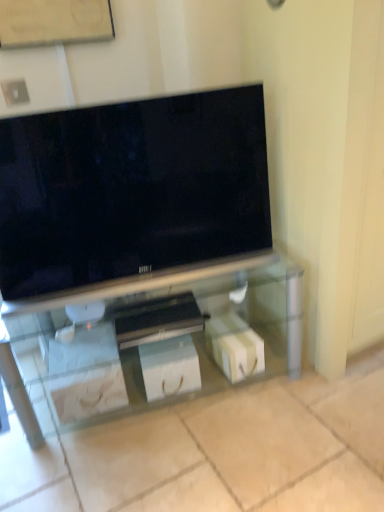
Question: In which direction should I rotate to look at white paper bag at lower center, the first box in the left-to-right sequence?

Choices:
 (A) left
 (B) right

Answer: (A)

Question: Can you confirm if wooden bulletin board at upper center is wider than white paper bag at lower center, the first box in the left-to-right sequence?

Choices:
 (A) yes
 (B) no

Answer: (B)

Question: From the image's perspective, does wooden bulletin board at upper center appear higher than white paper bag at lower center, the first box in the left-to-right sequence?

Choices:
 (A) no
 (B) yes

Answer: (B)

Question: Considering the relative positions of wooden bulletin board at upper center and white paper bag at lower center, the first box in the left-to-right sequence, in the image provided, is wooden bulletin board at upper center to the left of white paper bag at lower center, the first box in the left-to-right sequence, from the viewer's perspective?

Choices:
 (A) no
 (B) yes

Answer: (B)

Question: Could you tell me if wooden bulletin board at upper center is turned towards white paper bag at lower center, arranged as the 2th box when viewed from the right?

Choices:
 (A) yes
 (B) no

Answer: (B)

Question: From a real-world perspective, is wooden bulletin board at upper center located beneath white paper bag at lower center, arranged as the 2th box when viewed from the right?

Choices:
 (A) no
 (B) yes

Answer: (A)

Question: Is wooden bulletin board at upper center to the right of white paper bag at lower center, arranged as the 2th box when viewed from the right, from the viewer's perspective?

Choices:
 (A) yes
 (B) no

Answer: (B)

Question: From a real-world perspective, is clear glass tv stand at center located higher than wooden bulletin board at upper center?

Choices:
 (A) yes
 (B) no

Answer: (B)

Question: Can you confirm if clear glass tv stand at center is bigger than wooden bulletin board at upper center?

Choices:
 (A) no
 (B) yes

Answer: (B)

Question: Considering the relative sizes of clear glass tv stand at center and wooden bulletin board at upper center in the image provided, is clear glass tv stand at center smaller than wooden bulletin board at upper center?

Choices:
 (A) yes
 (B) no

Answer: (B)

Question: Is wooden bulletin board at upper center inside clear glass tv stand at center?

Choices:
 (A) no
 (B) yes

Answer: (A)

Question: Is clear glass tv stand at center at the left side of wooden bulletin board at upper center?

Choices:
 (A) no
 (B) yes

Answer: (A)

Question: Can you confirm if clear glass tv stand at center is taller than wooden bulletin board at upper center?

Choices:
 (A) no
 (B) yes

Answer: (B)

Question: Can you confirm if wooden bulletin board at upper center is shorter than white glossy box at center, which ranks as the 2th box in left-to-right order?

Choices:
 (A) yes
 (B) no

Answer: (A)